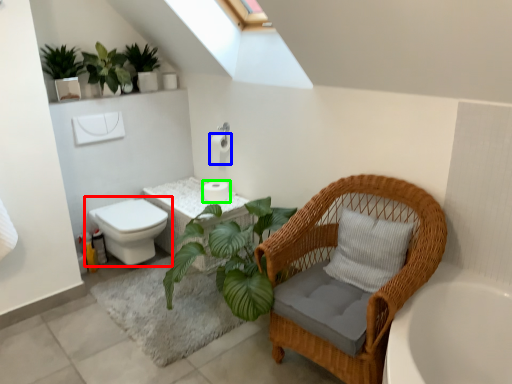
Question: Which object is positioned farthest from toilet (highlighted by a red box)? Select from toilet paper (highlighted by a blue box) and toilet paper (highlighted by a green box).

Choices:
 (A) toilet paper
 (B) toilet paper

Answer: (A)